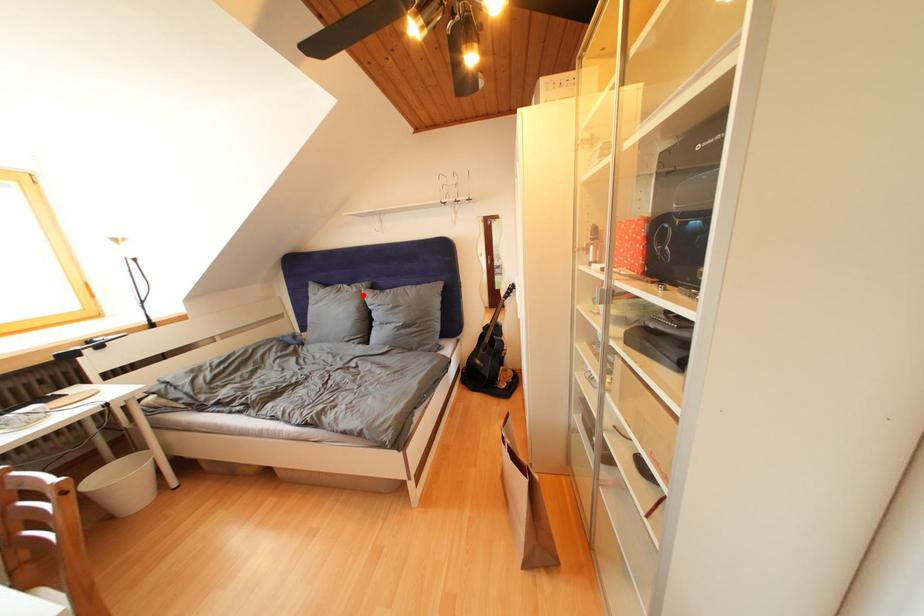
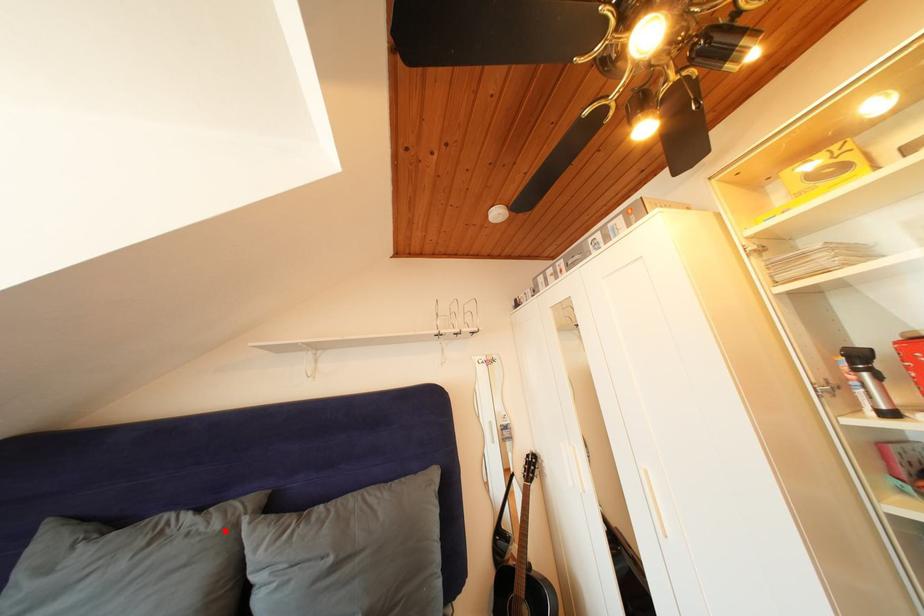
I am providing you with two images of the same scene from different viewpoints. A red point is marked on the first image and another point is marked on the second image. Does the point marked in image1 correspond to the same location as the one in image2?

Yes